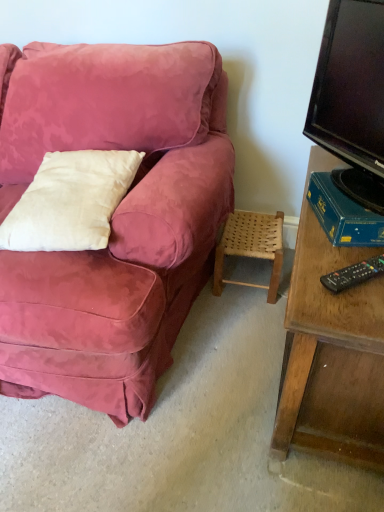
Question: Is black plastic remote control at lower right oriented towards black glossy tv at right?

Choices:
 (A) no
 (B) yes

Answer: (A)

Question: Would you consider black plastic remote control at lower right to be distant from black glossy tv at right?

Choices:
 (A) yes
 (B) no

Answer: (B)

Question: Would you say black glossy tv at right is part of black plastic remote control at lower right's contents?

Choices:
 (A) no
 (B) yes

Answer: (A)

Question: Is black plastic remote control at lower right at the left side of black glossy tv at right?

Choices:
 (A) no
 (B) yes

Answer: (B)

Question: Would you say black plastic remote control at lower right is outside black glossy tv at right?

Choices:
 (A) no
 (B) yes

Answer: (B)

Question: Is white cotton pillow at left situated inside woven wood stool at lower right or outside?

Choices:
 (A) inside
 (B) outside

Answer: (B)

Question: Visually, is white cotton pillow at left positioned to the left or to the right of woven wood stool at lower right?

Choices:
 (A) right
 (B) left

Answer: (B)

Question: Considering the positions of white cotton pillow at left and woven wood stool at lower right in the image, is white cotton pillow at left wider or thinner than woven wood stool at lower right?

Choices:
 (A) wide
 (B) thin

Answer: (A)

Question: Looking at the image, does white cotton pillow at left seem bigger or smaller compared to woven wood stool at lower right?

Choices:
 (A) big
 (B) small

Answer: (A)

Question: Would you say woven wood stool at lower right is inside or outside black plastic remote control at lower right?

Choices:
 (A) inside
 (B) outside

Answer: (B)

Question: Is point (228, 251) closer or farther from the camera than point (349, 287)?

Choices:
 (A) farther
 (B) closer

Answer: (A)

Question: From a real-world perspective, is woven wood stool at lower right positioned above or below black plastic remote control at lower right?

Choices:
 (A) below
 (B) above

Answer: (A)

Question: Is woven wood stool at lower right in front of or behind black plastic remote control at lower right in the image?

Choices:
 (A) front
 (B) behind

Answer: (B)

Question: Do you think white cotton pillow at left is within black plastic remote control at lower right, or outside of it?

Choices:
 (A) outside
 (B) inside

Answer: (A)

Question: Considering the positions of white cotton pillow at left and black plastic remote control at lower right in the image, is white cotton pillow at left taller or shorter than black plastic remote control at lower right?

Choices:
 (A) tall
 (B) short

Answer: (A)